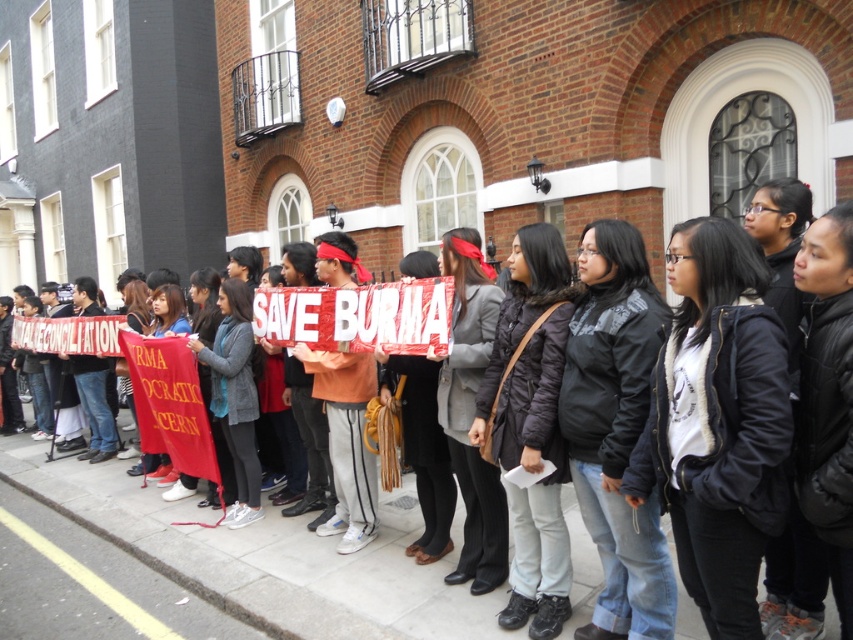
Which of these two, red fabric banner at center or yellow painted line at lower center, stands shorter?

yellow painted line at lower center is shorter.

Does red fabric banner at center have a smaller size compared to yellow painted line at lower center?

Actually, red fabric banner at center might be larger than yellow painted line at lower center.

Does point (155, 529) come closer to viewer compared to point (51, 541)?

Yes, point (155, 529) is closer to viewer.

Find the location of a particular element. Image resolution: width=853 pixels, height=640 pixels. red fabric banner at center is located at coordinates (268, 557).